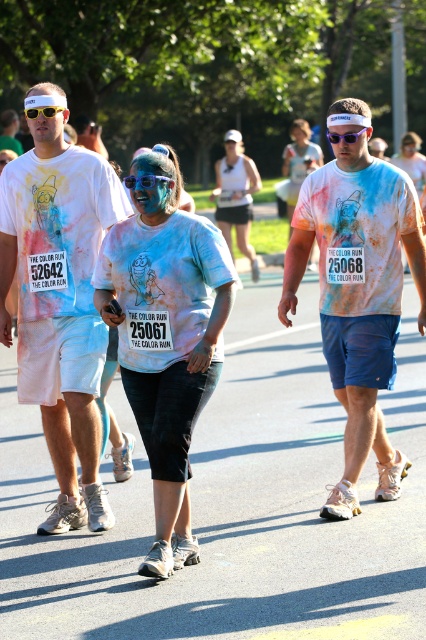
Based on the photo, who is positioned more to the right, blue matte goggles at center or yellow plastic goggles at center?

blue matte goggles at center

Does blue matte goggles at center appear on the left side of yellow plastic goggles at center?

Incorrect, blue matte goggles at center is not on the left side of yellow plastic goggles at center.

Where is `blue matte goggles at center`? The width and height of the screenshot is (426, 640). blue matte goggles at center is located at coordinates (144, 180).

Which is more to the left, matte tie-dye t-shirt at center or white tie-dye t-shirt at center?

matte tie-dye t-shirt at center is more to the left.

Image resolution: width=426 pixels, height=640 pixels. What do you see at coordinates (60, 305) in the screenshot? I see `matte tie-dye t-shirt at center` at bounding box center [60, 305].

In order to click on matte tie-dye t-shirt at center in this screenshot , I will do `click(60, 305)`.

Who is lower down, matte tie-dye t-shirt at center or blue matte goggles at center?

matte tie-dye t-shirt at center is lower down.

Is matte tie-dye t-shirt at center to the right of blue matte goggles at center from the viewer's perspective?

No, matte tie-dye t-shirt at center is not to the right of blue matte goggles at center.

What do you see at coordinates (60, 305) in the screenshot? I see `matte tie-dye t-shirt at center` at bounding box center [60, 305].

Find the location of a particular element. Image resolution: width=426 pixels, height=640 pixels. matte tie-dye t-shirt at center is located at coordinates (60, 305).